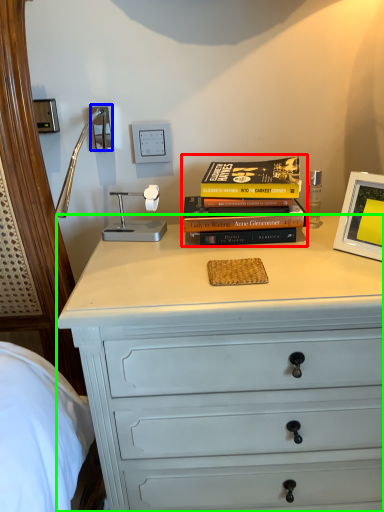
Question: Estimate the real-world distances between objects in this image. Which object is closer to book (highlighted by a red box), electric outlet (highlighted by a blue box) or chest of drawers (highlighted by a green box)?

Choices:
 (A) electric outlet
 (B) chest of drawers

Answer: (B)